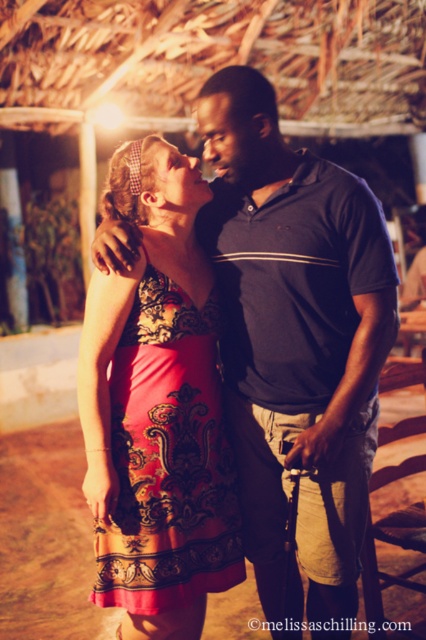
Question: Is floral-patterned fabric dress at center above smooth skin forehead at center?

Choices:
 (A) yes
 (B) no

Answer: (B)

Question: Among these points, which one is nearest to the camera?

Choices:
 (A) (215, 298)
 (B) (199, 113)
 (C) (313, 365)

Answer: (B)

Question: Which is farther from the floral-patterned fabric dress at center?

Choices:
 (A) matte black shirt at center
 (B) smooth skin forehead at center

Answer: (B)

Question: Is matte black shirt at center to the right of floral-patterned fabric dress at center from the viewer's perspective?

Choices:
 (A) no
 (B) yes

Answer: (B)

Question: Among these objects, which one is nearest to the camera?

Choices:
 (A) smooth skin forehead at center
 (B) matte black shirt at center
 (C) floral-patterned fabric dress at center

Answer: (C)

Question: Can you confirm if floral-patterned fabric dress at center is positioned to the right of smooth skin forehead at center?

Choices:
 (A) no
 (B) yes

Answer: (A)